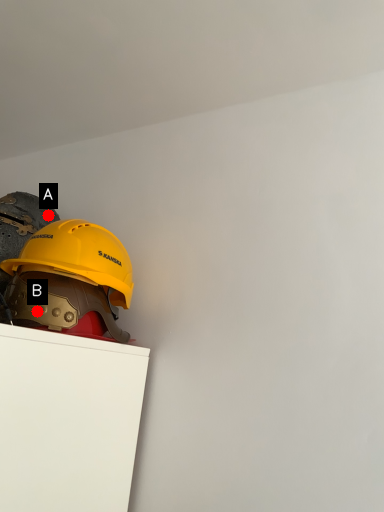
Question: Two points are circled on the image, labeled by A and B beside each circle. Which point is closer to the camera?

Choices:
 (A) A is closer
 (B) B is closer

Answer: (B)